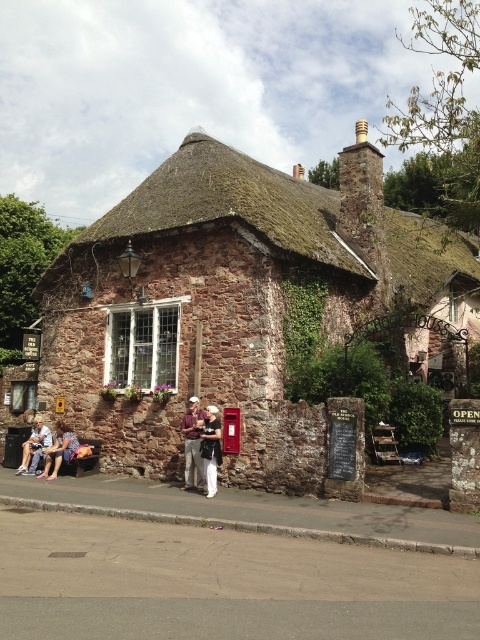
You are standing in front of the rustic stone cottage at center and the white cotton shirt at center. Which object is positioned to the left?

The white cotton shirt at center is positioned to the left of the rustic stone cottage at center.

You are standing at the origin point of the coordinate system. The cottage is located at point 0.478, 0.471. If you walk straight ahead, will you reach the rustic stone cottage at center?

Yes, because the rustic stone cottage at center is located at point (226, 305), which is directly in front of you along the path you are walking.